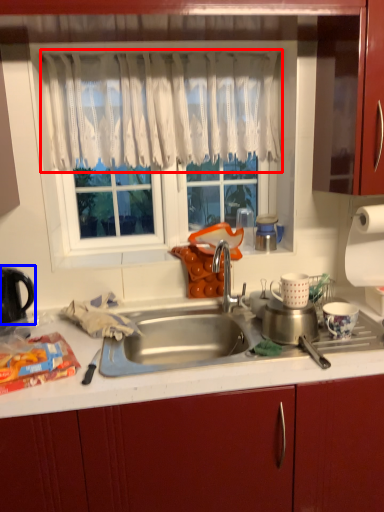
Question: Which of the following is the closest to the observer, curtain (highlighted by a red box) or kitchen appliance (highlighted by a blue box)?

Choices:
 (A) curtain
 (B) kitchen appliance

Answer: (B)